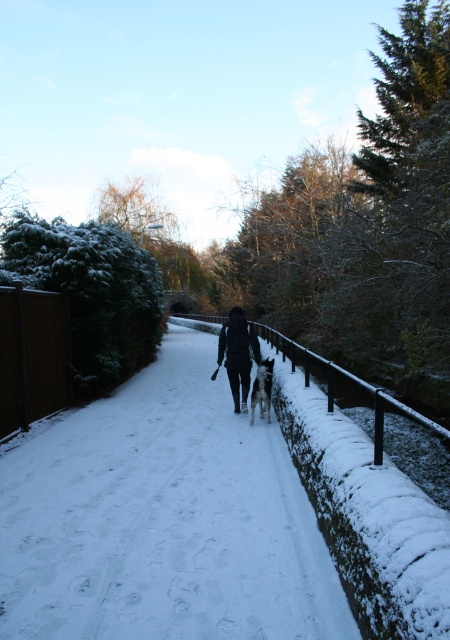
Can you confirm if white snow at center is taller than black matte jacket at center?

Incorrect, white snow at center's height is not larger of black matte jacket at center's.

Who is more forward, (144, 593) or (255, 346)?

Point (144, 593) is more forward.

Identify the location of white snow at center. The height and width of the screenshot is (640, 450). (162, 518).

Is black matte jacket at center in front of white fur dog at center?

No, black matte jacket at center is further to the viewer.

Can you confirm if black matte jacket at center is taller than white fur dog at center?

Yes, black matte jacket at center is taller than white fur dog at center.

At what (x,y) coordinates should I click in order to perform the action: click on black matte jacket at center. Please return your answer as a coordinate pair (x, y). The width and height of the screenshot is (450, 640). Looking at the image, I should click on (238, 355).

Does white snow at center have a larger size compared to white fur dog at center?

Yes, white snow at center is bigger than white fur dog at center.

Locate an element on the screen. white snow at center is located at coordinates (162, 518).

You are a GUI agent. You are given a task and a screenshot of the screen. Output one action in this format:
    pyautogui.click(x=<x>, y=<y>)
    Task: Click on the white snow at center
    This screenshot has height=640, width=450.
    Given the screenshot: What is the action you would take?
    pyautogui.click(x=162, y=518)